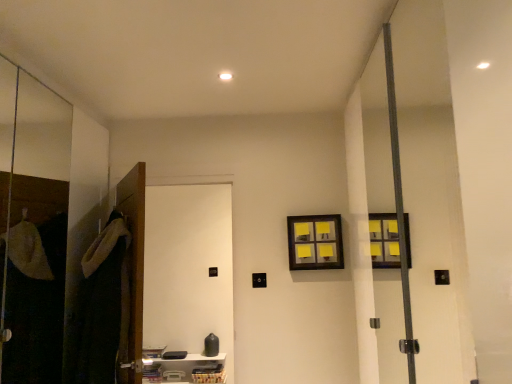
At what (x,y) coordinates should I click in order to perform the action: click on free location above transparent glass screen door at left, the second screen door viewed from the right (from a real-world perspective). Please return your answer as a coordinate pair (x, y). This screenshot has height=384, width=512. Looking at the image, I should click on (53, 73).